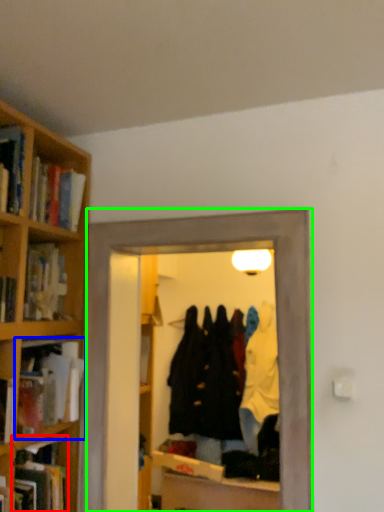
Question: Considering the real-world distances, which object is closest to book (highlighted by a red box)? book (highlighted by a blue box) or glass door (highlighted by a green box).

Choices:
 (A) book
 (B) glass door

Answer: (A)